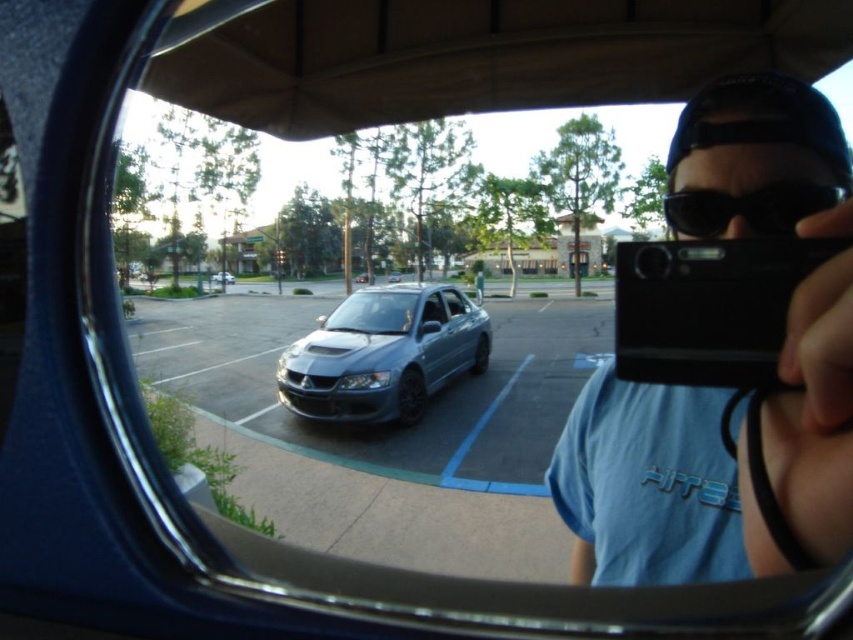
Can you confirm if blue cotton shirt at center is taller than satin silver sedan at center?

Yes.

Who is taller, blue cotton shirt at center or satin silver sedan at center?

Standing taller between the two is blue cotton shirt at center.

Between point (666, 509) and point (389, 273), which one is positioned in front?

Positioned in front is point (666, 509).

This screenshot has width=853, height=640. I want to click on blue cotton shirt at center, so click(656, 486).

Which is below, satin metallic car at center or satin metallic sedan at center?

satin metallic sedan at center is below.

Which is behind, point (248, 321) or point (326, 342)?

The point (248, 321) is behind.

The image size is (853, 640). Find the location of `satin metallic car at center`. satin metallic car at center is located at coordinates (381, 381).

Does blue cotton shirt at center lie in front of satin metallic car at center?

Yes, it is.

Is blue cotton shirt at center thinner than satin metallic car at center?

Correct, blue cotton shirt at center's width is less than satin metallic car at center's.

At what (x,y) coordinates should I click in order to perform the action: click on blue cotton shirt at center. Please return your answer as a coordinate pair (x, y). This screenshot has height=640, width=853. Looking at the image, I should click on (656, 486).